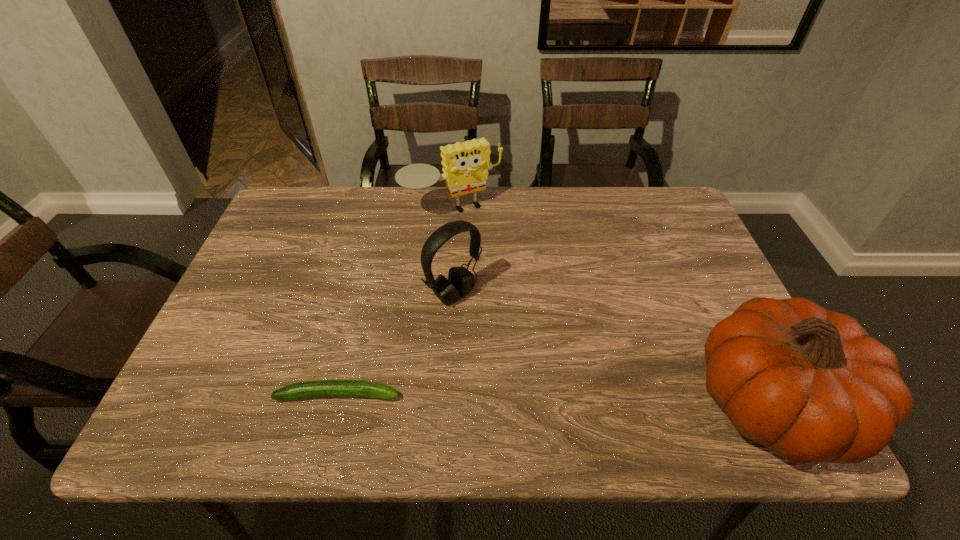
The image size is (960, 540). I want to click on blank area located 0.070m on the front-facing side of the second farthest object, so click(x=492, y=326).

Identify the location of object located in the far edge section of the desktop. The height and width of the screenshot is (540, 960). (465, 165).

Locate an element on the screen. The width and height of the screenshot is (960, 540). zucchini that is at the near edge is located at coordinates (326, 388).

Identify the location of pumpkin located in the near edge section of the desktop. The width and height of the screenshot is (960, 540). (810, 384).

Identify the location of object that is at the right edge. (810, 384).

Find the location of `object that is at the near right corner`. object that is at the near right corner is located at coordinates (810, 384).

In the image, there is a desktop. In order to click on vacant space at the far edge in this screenshot , I will do `click(606, 188)`.

In the image, there is a desktop. At what (x,y) coordinates should I click in order to perform the action: click on vacant area at the near edge. Please return your answer as a coordinate pair (x, y). Image resolution: width=960 pixels, height=540 pixels. Looking at the image, I should click on (326, 372).

The image size is (960, 540). In the image, there is a desktop. Find the location of `vacant space at the left edge`. vacant space at the left edge is located at coordinates (255, 252).

I want to click on vacant region at the right edge of the desktop, so click(x=643, y=244).